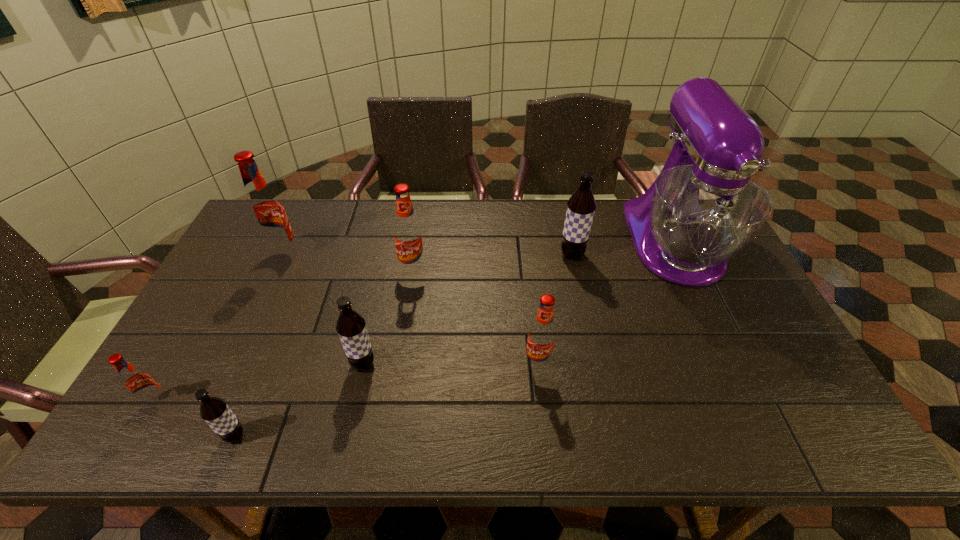
This screenshot has height=540, width=960. Find the location of `the fourth root beer from right to left`. the fourth root beer from right to left is located at coordinates (351, 327).

Locate an element on the screen. Image resolution: width=960 pixels, height=540 pixels. the second biggest brown root beer is located at coordinates (351, 327).

The width and height of the screenshot is (960, 540). In order to click on the leftmost red root beer in this screenshot , I will do `click(138, 383)`.

This screenshot has height=540, width=960. I want to click on the leftmost root beer, so click(x=138, y=383).

The height and width of the screenshot is (540, 960). I want to click on the nearest root beer, so click(214, 411).

The image size is (960, 540). I want to click on the nearest brown root beer, so click(x=214, y=411).

Where is `blank area located at the bowl opening of the mixer`? blank area located at the bowl opening of the mixer is located at coordinates (718, 335).

Identify the location of free space located on the left of the second red root beer from left to right. (237, 255).

This screenshot has height=540, width=960. Find the location of `vacant area located on the front of the second red root beer from right to left`. vacant area located on the front of the second red root beer from right to left is located at coordinates (401, 346).

You are a GUI agent. You are given a task and a screenshot of the screen. Output one action in this format:
    pyautogui.click(x=<x>, y=<y>)
    Task: Click on the blank area located on the right of the biggest brown root beer
    Image resolution: width=960 pixels, height=540 pixels.
    Given the screenshot: What is the action you would take?
    pyautogui.click(x=604, y=255)